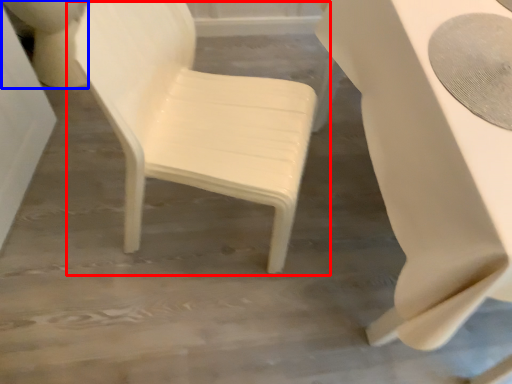
Question: Among these objects, which one is farthest to the camera, chair (highlighted by a red box) or toilet bowl (highlighted by a blue box)?

Choices:
 (A) chair
 (B) toilet bowl

Answer: (B)